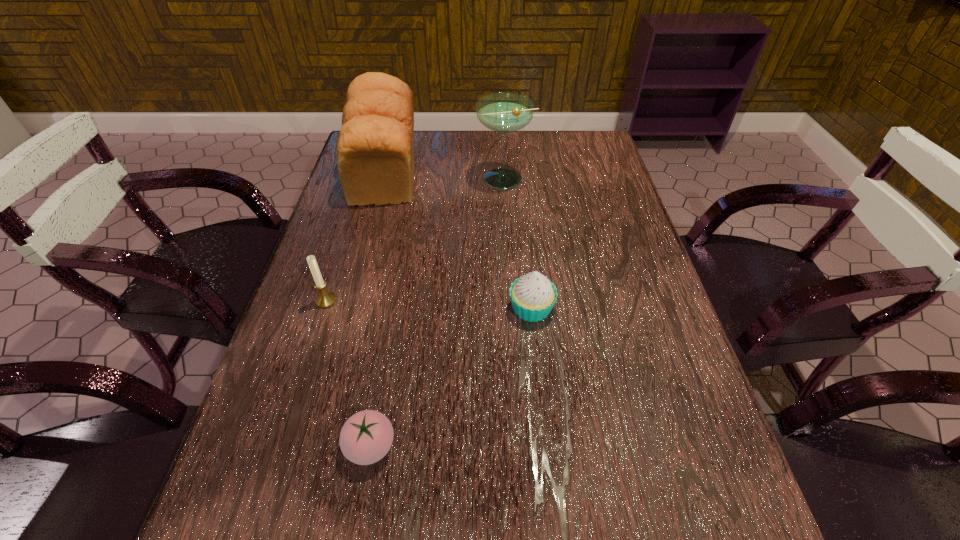
Where is `bread`? The width and height of the screenshot is (960, 540). bread is located at coordinates (375, 148).

The image size is (960, 540). What are the coordinates of `martini` in the screenshot? It's located at click(503, 112).

Identify the location of the third shortest object. (325, 299).

You are a GUI agent. You are given a task and a screenshot of the screen. Output one action in this format:
    pyautogui.click(x=<x>, y=<y>)
    Task: Click on the cupcake
    The image size is (960, 540).
    Given the screenshot: What is the action you would take?
    pyautogui.click(x=533, y=296)

This screenshot has width=960, height=540. I want to click on tomato, so click(366, 437).

At what (x,y) coordinates should I click in order to perform the action: click on the nearest object. Please return your answer as a coordinate pair (x, y). The image size is (960, 540). Looking at the image, I should click on (366, 437).

Where is `vacant position located 0.320m on the front of the bread`? vacant position located 0.320m on the front of the bread is located at coordinates (350, 298).

Locate an element on the screen. free space located on the right of the martini is located at coordinates (601, 179).

At what (x,y) coordinates should I click in order to perform the action: click on vacant space located 0.260m on the front of the third shortest object. Please return your answer as a coordinate pair (x, y). The image size is (960, 540). Looking at the image, I should click on (286, 426).

The width and height of the screenshot is (960, 540). Find the location of `vacant space located on the right of the second shortest object`. vacant space located on the right of the second shortest object is located at coordinates (635, 308).